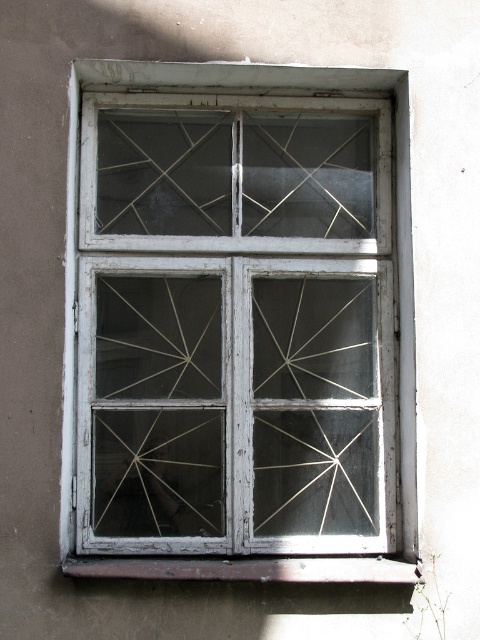
You are looking at the window with two points marked on it. Which point is closer to you, point at (317, 275) or point at (302, 573)?

Point at (317, 275) is closer to you than point at (302, 573).